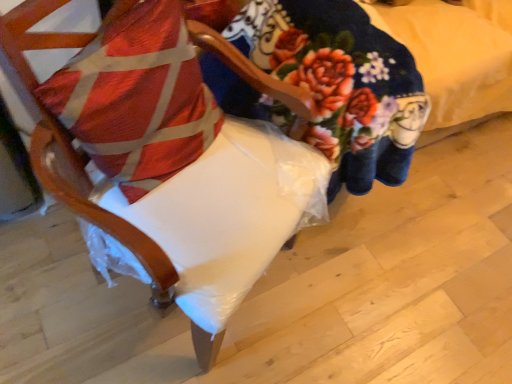
Question: Is white fabric chair at center taller than textured red pillow at left?

Choices:
 (A) no
 (B) yes

Answer: (B)

Question: Does white fabric chair at center have a smaller size compared to textured red pillow at left?

Choices:
 (A) no
 (B) yes

Answer: (A)

Question: Does white fabric chair at center lie in front of textured red pillow at left?

Choices:
 (A) yes
 (B) no

Answer: (A)

Question: Is white fabric chair at center at the left side of textured red pillow at left?

Choices:
 (A) yes
 (B) no

Answer: (B)

Question: Could you tell me if white fabric chair at center is facing textured red pillow at left?

Choices:
 (A) yes
 (B) no

Answer: (A)

Question: Is textured red pillow at left located within white fabric chair at center?

Choices:
 (A) no
 (B) yes

Answer: (B)

Question: Does textured red pillow at left appear on the right side of white fabric chair at center?

Choices:
 (A) yes
 (B) no

Answer: (B)

Question: Does textured red pillow at left have a larger size compared to white fabric chair at center?

Choices:
 (A) no
 (B) yes

Answer: (A)

Question: Is textured red pillow at left far away from white fabric chair at center?

Choices:
 (A) no
 (B) yes

Answer: (A)

Question: Can you confirm if textured red pillow at left is wider than white fabric chair at center?

Choices:
 (A) no
 (B) yes

Answer: (A)

Question: Is textured red pillow at left positioned beyond the bounds of white fabric chair at center?

Choices:
 (A) no
 (B) yes

Answer: (A)

Question: From a real-world perspective, is textured red pillow at left positioned under white fabric chair at center based on gravity?

Choices:
 (A) yes
 (B) no

Answer: (B)

Question: Considering their positions, is textured red pillow at left located in front of or behind white fabric chair at center?

Choices:
 (A) behind
 (B) front

Answer: (A)